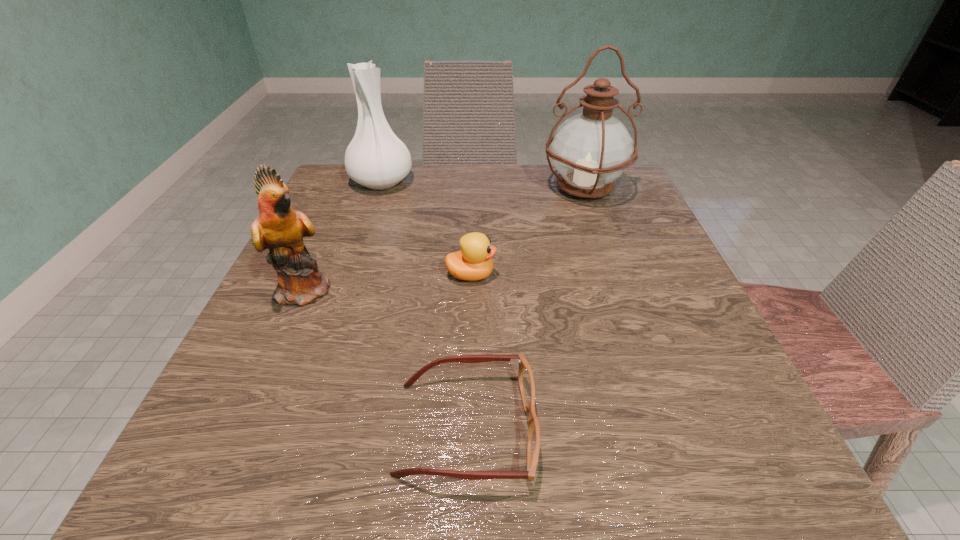
Where is `free space at the far edge of the desktop`? free space at the far edge of the desktop is located at coordinates coord(448,208).

Locate an element on the screen. vacant point at the left edge is located at coordinates (269, 394).

Identify the location of vacant region at the right edge. This screenshot has height=540, width=960. (582, 227).

I want to click on vacant area at the far left corner of the desktop, so click(x=340, y=173).

Find the location of a particular element. The width and height of the screenshot is (960, 540). vacant area at the near left corner is located at coordinates (262, 444).

The width and height of the screenshot is (960, 540). I want to click on free spot at the far right corner of the desktop, so click(x=628, y=171).

What are the coordinates of `free spot at the near right corner of the desktop` in the screenshot? It's located at (697, 438).

You are a GUI agent. You are given a task and a screenshot of the screen. Output one action in this format:
    pyautogui.click(x=<x>, y=<y>)
    Task: Click on the vacant point located between the second shortest object and the oil lamp
    
    Given the screenshot: What is the action you would take?
    pyautogui.click(x=528, y=232)

Where is `vacant area that lies between the duckling and the tallest object`? This screenshot has width=960, height=540. vacant area that lies between the duckling and the tallest object is located at coordinates tap(528, 232).

The height and width of the screenshot is (540, 960). I want to click on unoccupied area between the parrot and the duckling, so click(x=389, y=282).